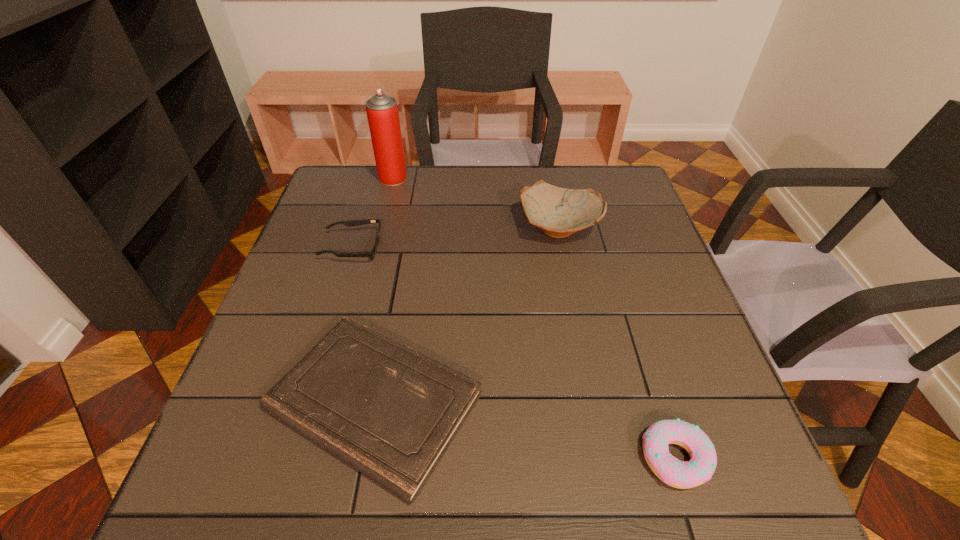
At what (x,y) coordinates should I click in order to perform the action: click on the tallest object. Please return your answer as a coordinate pair (x, y). Looking at the image, I should click on (382, 112).

The height and width of the screenshot is (540, 960). What are the coordinates of `aerosol can` in the screenshot? It's located at (382, 112).

Where is `the second tallest object`? This screenshot has height=540, width=960. the second tallest object is located at coordinates (559, 212).

Identify the location of sunglasses. This screenshot has width=960, height=540. (352, 223).

Where is `doughnut`? The width and height of the screenshot is (960, 540). doughnut is located at coordinates (699, 469).

I want to click on paperback book, so click(x=389, y=411).

Where is `vacant area situated on the front of the farthest object`? Image resolution: width=960 pixels, height=540 pixels. vacant area situated on the front of the farthest object is located at coordinates (380, 228).

Where is `free space located on the front of the pottery`? This screenshot has height=540, width=960. free space located on the front of the pottery is located at coordinates (566, 265).

I want to click on blank space located 0.320m on the front-facing side of the sunglasses, so click(507, 248).

Find the location of `free region located 0.230m on the left of the doughnut`. free region located 0.230m on the left of the doughnut is located at coordinates (506, 458).